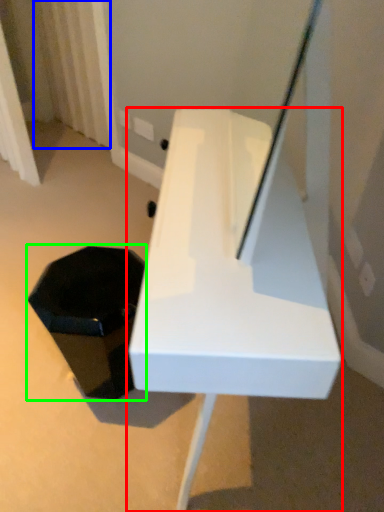
Question: Which object is the farthest from furniture (highlighted by a red box)? Choose among these: curtain (highlighted by a blue box) or storage box (highlighted by a green box).

Choices:
 (A) curtain
 (B) storage box

Answer: (A)